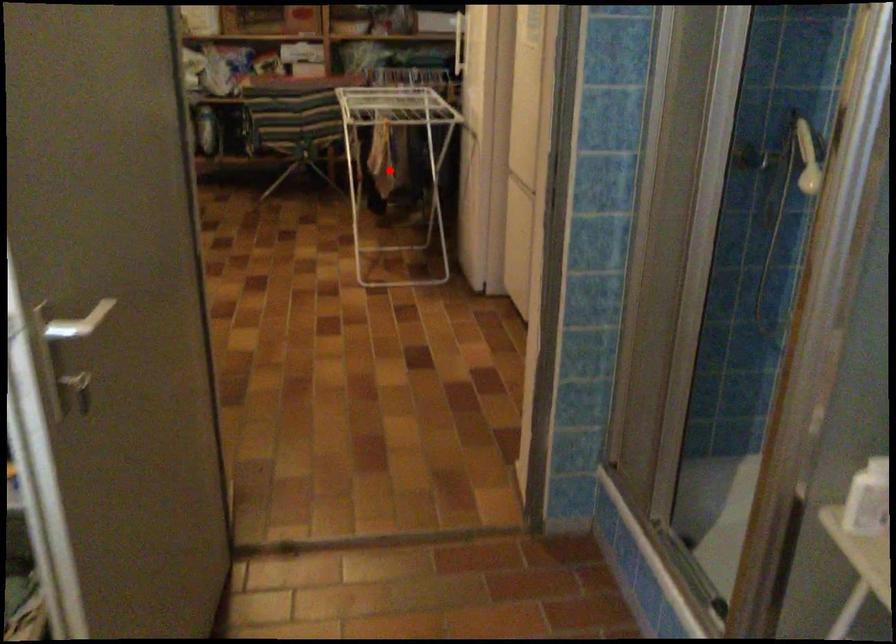
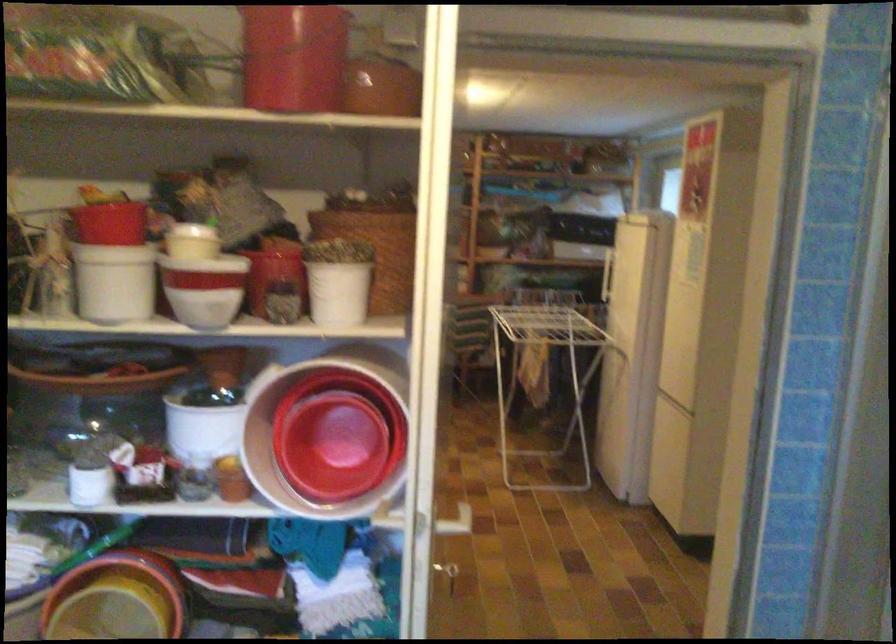
Question: I am providing you with two images of the same scene from different viewpoints. A red point is marked on the first image. At the location where the point appears in image 1, is it still visible in image 2?

Choices:
 (A) Yes
 (B) No

Answer: (A)